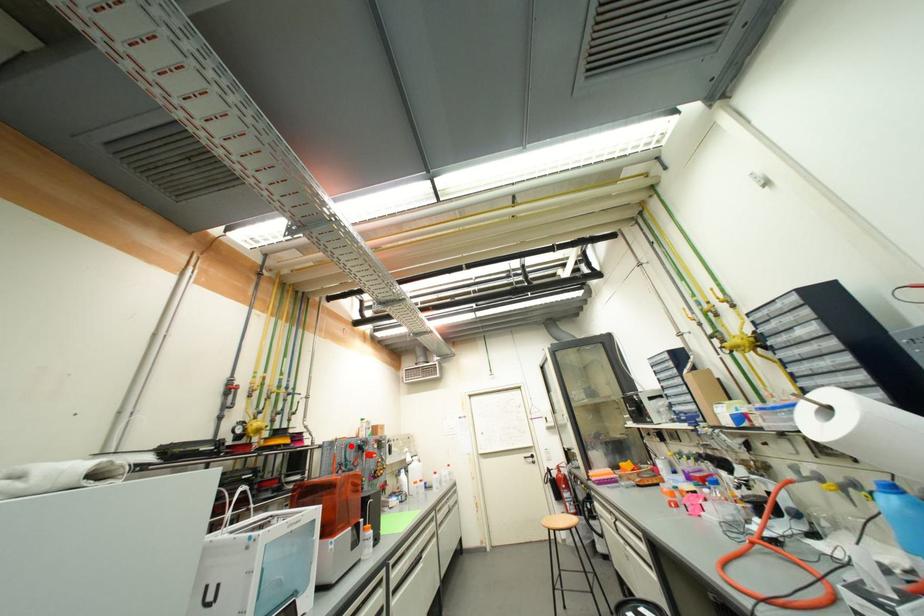
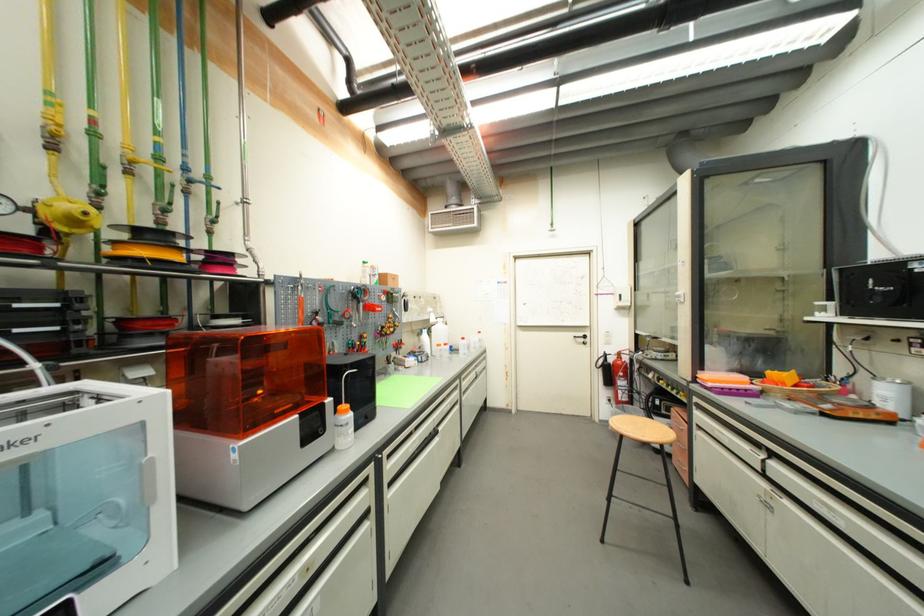
Find the pixel in the second image that matches the highlighted location in the first image.

(334, 289)